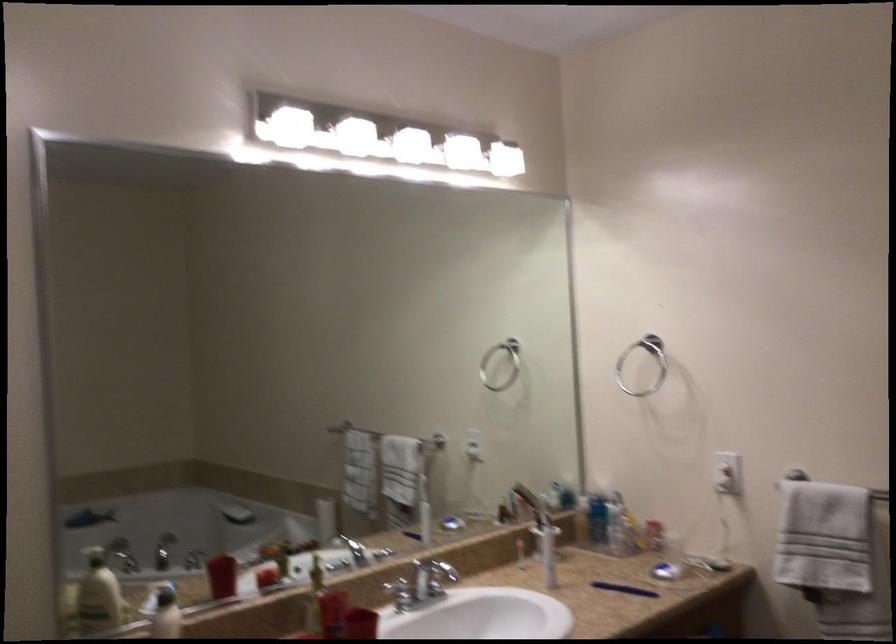
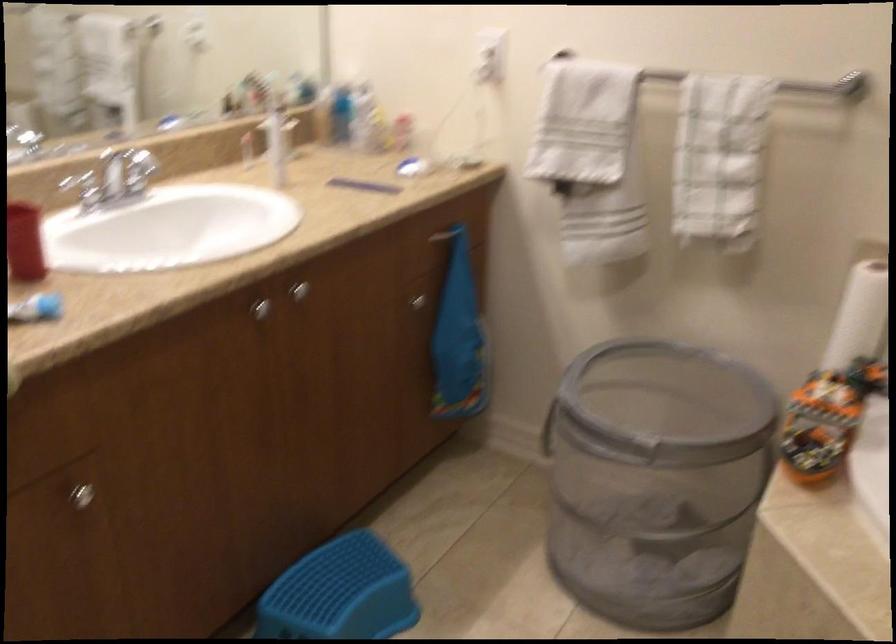
The images are taken continuously from a first-person perspective. In which direction is your viewpoint rotating?

The camera rotated toward right-down.